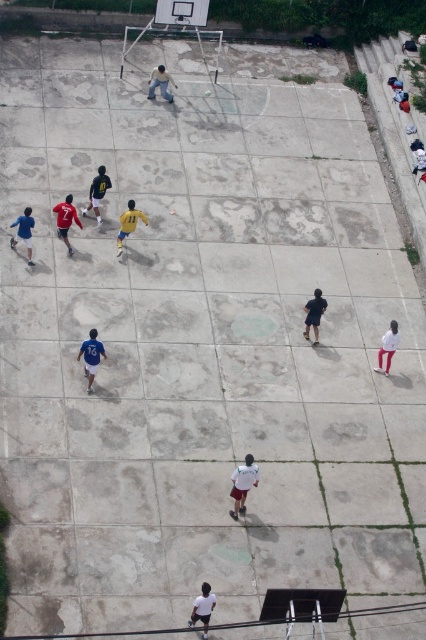
Question: Which object appears closest to the camera in this image?

Choices:
 (A) light brown leather shoes at center
 (B) blue matte jersey at lower left

Answer: (B)

Question: Which object is positioned farthest from the white matte shirt at center?

Choices:
 (A) light brown leather shoes at center
 (B) blue fabric shirt at left
 (C) matte red jersey at left

Answer: (A)

Question: Which of the following is the closest to the observer?

Choices:
 (A) (63, 205)
 (B) (31, 211)
 (C) (86, 364)
 (D) (235, 477)

Answer: (D)

Question: Is white matte shirt at center positioned in front of dark blue jersey at center?

Choices:
 (A) no
 (B) yes

Answer: (B)

Question: Is blue matte jersey at lower left below blue fabric shirt at left?

Choices:
 (A) no
 (B) yes

Answer: (B)

Question: Is white matte shirt at lower center positioned at the back of yellow matte jersey at center?

Choices:
 (A) yes
 (B) no

Answer: (B)